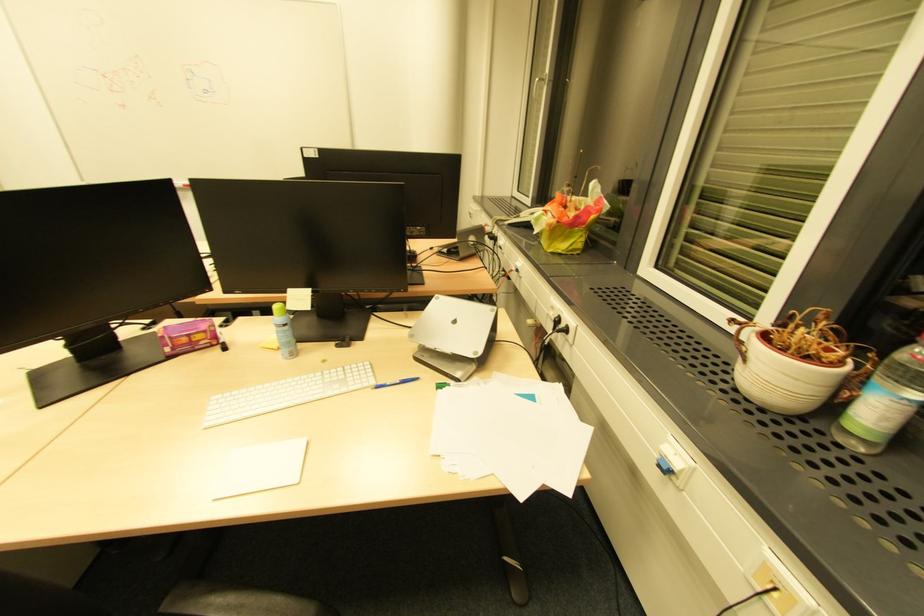
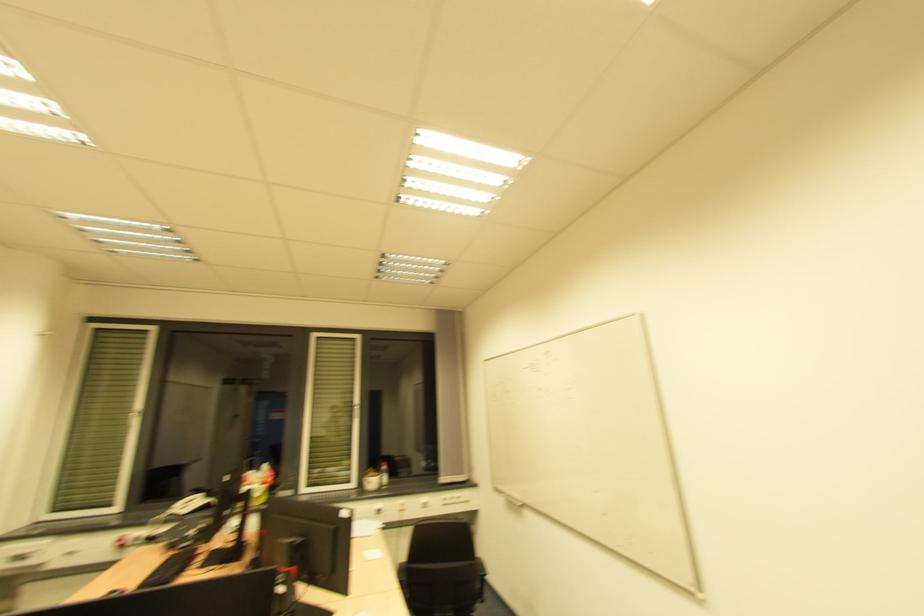
Question: I am providing you with two images of the same scene from different viewpoints. Which of the following objects are not visible in image2?

Choices:
 (A) telephone receiver
 (B) white computer keyboard
 (C) dark pill bottle
 (D) black chair sitting surface

Answer: (B)